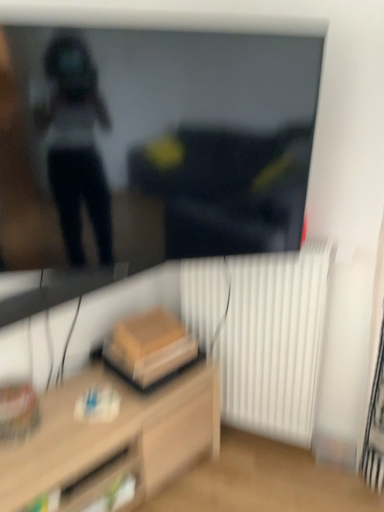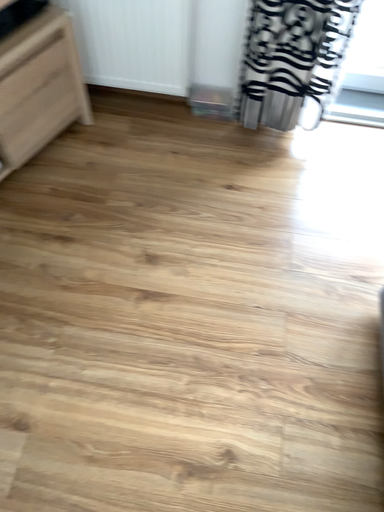
Question: How did the camera likely rotate when shooting the video?

Choices:
 (A) rotated right
 (B) rotated left

Answer: (A)